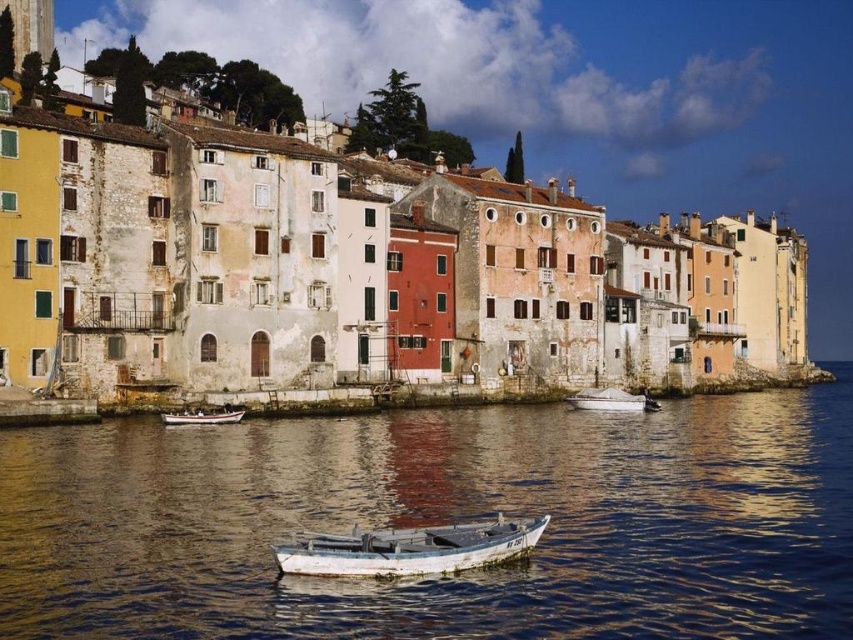
Question: Does white matte boat at center have a lesser width compared to white wooden boat at center?

Choices:
 (A) no
 (B) yes

Answer: (A)

Question: Which object is farther from the camera taking this photo?

Choices:
 (A) smooth water at center
 (B) white wooden boat at lower center
 (C) white matte boat at center
 (D) white wooden boat at center

Answer: (C)

Question: Among these objects, which one is nearest to the camera?

Choices:
 (A) white wooden boat at lower center
 (B) white matte boat at center
 (C) smooth water at center

Answer: (C)

Question: Does smooth water at center have a larger size compared to white matte boat at center?

Choices:
 (A) no
 (B) yes

Answer: (B)

Question: Which object appears closest to the camera in this image?

Choices:
 (A) white matte boat at center
 (B) smooth water at center
 (C) white wooden boat at lower center
 (D) white wooden boat at center

Answer: (B)

Question: Is smooth water at center below white matte boat at center?

Choices:
 (A) no
 (B) yes

Answer: (B)